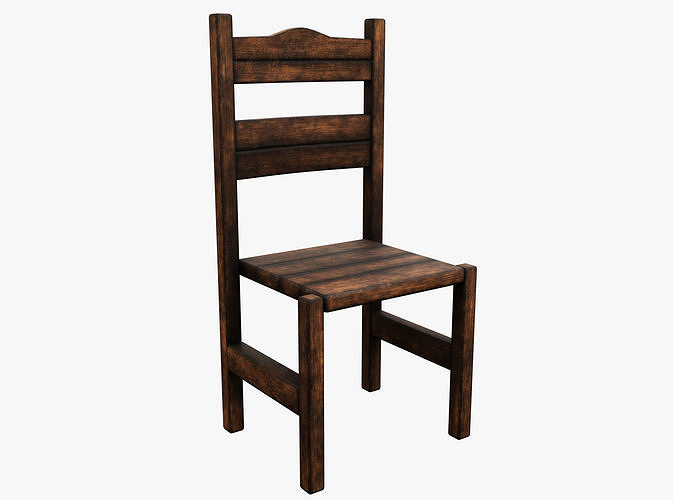
You are a GUI agent. You are given a task and a screenshot of the screen. Output one action in this format:
    pyautogui.click(x=<x>, y=<y>)
    Task: Click on the top rail
    The width and height of the screenshot is (673, 500).
    Given the screenshot: What is the action you would take?
    pyautogui.click(x=247, y=54)